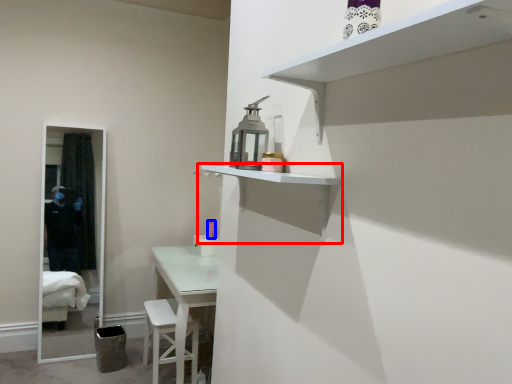
Question: Which point is closer to the camera, shelf (highlighted by a red box) or toiletry (highlighted by a blue box)?

Choices:
 (A) shelf
 (B) toiletry

Answer: (A)